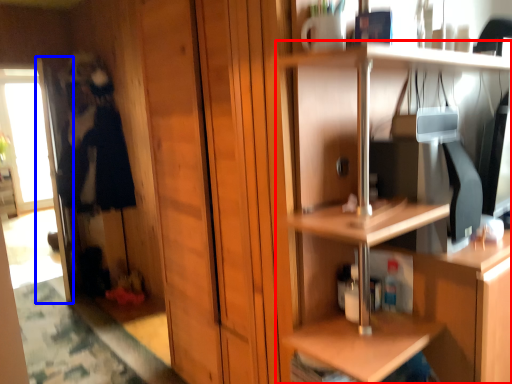
Question: Which point is further to the camera, shelf (highlighted by a red box) or screen door (highlighted by a blue box)?

Choices:
 (A) shelf
 (B) screen door

Answer: (B)